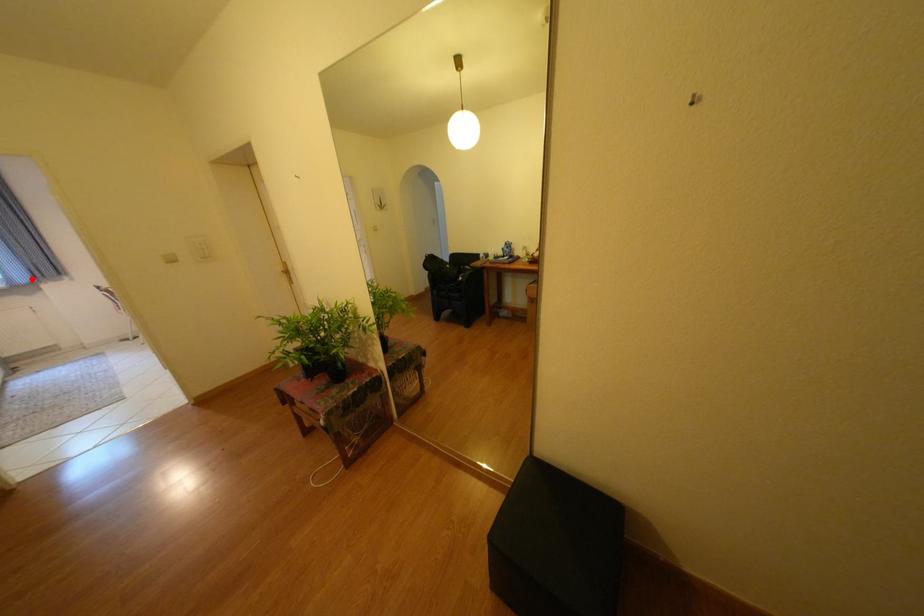
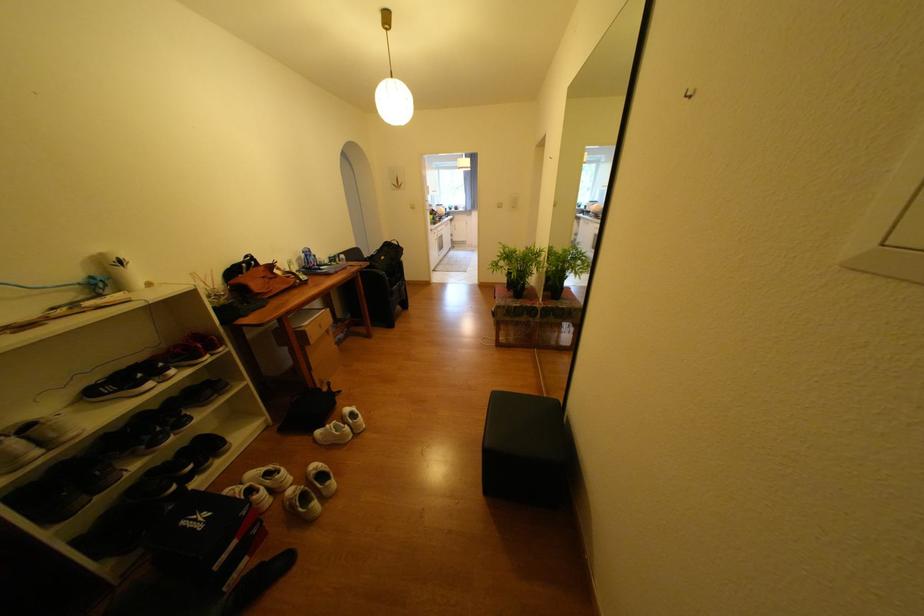
Question: I am providing you with two images of the same scene from different viewpoints. Given a red point in image1, look at the same physical point in image2. Is it:

Choices:
 (A) Closer to the viewpoint
 (B) Farther from the viewpoint

Answer: (A)